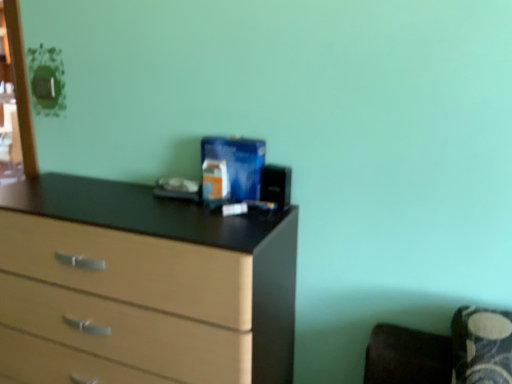
What are the coordinates of `matte wood chest of drawers at left` in the screenshot? It's located at (141, 287).

Describe the element at coordinates (141, 287) in the screenshot. I see `matte wood chest of drawers at left` at that location.

What is the approximate height of matte wood chest of drawers at left?

The height of matte wood chest of drawers at left is 38.21 inches.

Find the location of a particular element. Image resolution: width=512 pixels, height=384 pixels. matte wood chest of drawers at left is located at coordinates (141, 287).